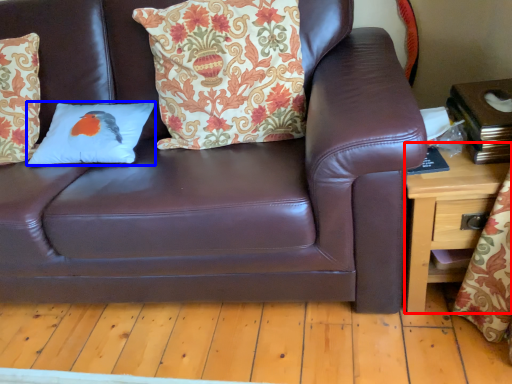
Question: Which point is closer to the camera, table (highlighted by a red box) or pillow (highlighted by a blue box)?

Choices:
 (A) table
 (B) pillow

Answer: (A)